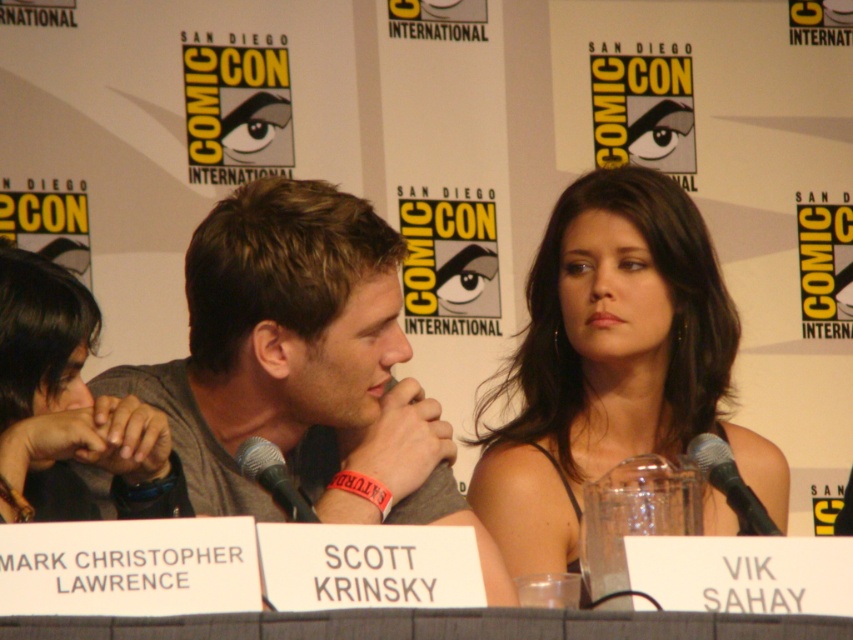
Does gray cotton shirt at center come in front of black metallic microphone at center?

No, gray cotton shirt at center is further to the viewer.

Is gray cotton shirt at center thinner than black metallic microphone at center?

No, gray cotton shirt at center is not thinner than black metallic microphone at center.

Locate an element on the screen. gray cotton shirt at center is located at coordinates (305, 368).

Who is taller, gray cotton shirt at center or dark brown hair at center?

Standing taller between the two is dark brown hair at center.

Consider the image. Is gray cotton shirt at center to the left of dark brown hair at center from the viewer's perspective?

Indeed, gray cotton shirt at center is positioned on the left side of dark brown hair at center.

Who is more forward, (296, 369) or (611, 401)?

Point (296, 369) is more forward.

Find the location of a particular element. gray cotton shirt at center is located at coordinates (305, 368).

Is dark brown hair at upper left shorter than black plastic microphone at center?

No, dark brown hair at upper left is not shorter than black plastic microphone at center.

Does dark brown hair at upper left have a lesser width compared to black plastic microphone at center?

In fact, dark brown hair at upper left might be wider than black plastic microphone at center.

Which is behind, point (62, 310) or point (280, 461)?

Point (62, 310)

The image size is (853, 640). I want to click on dark brown hair at upper left, so click(68, 406).